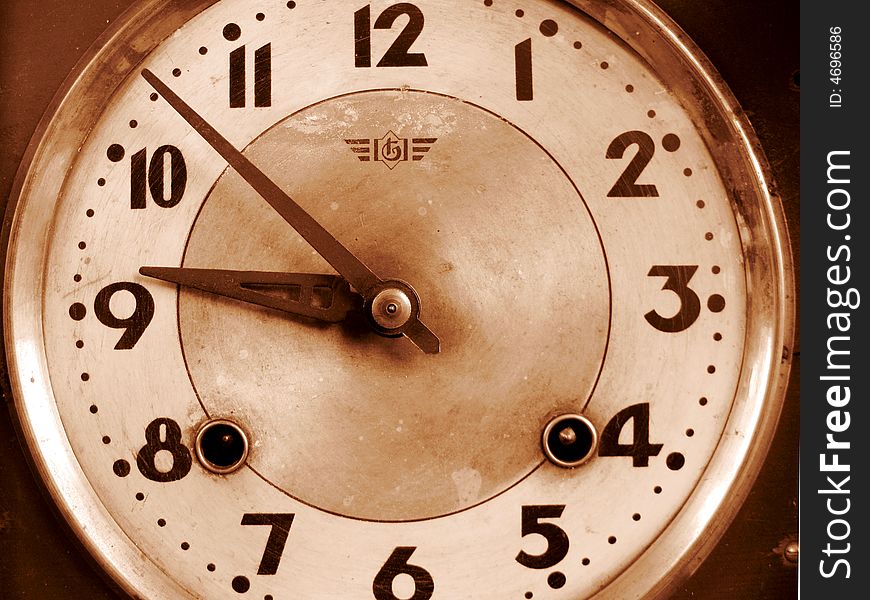
The width and height of the screenshot is (870, 600). Identify the location of clock face. click(x=478, y=263).